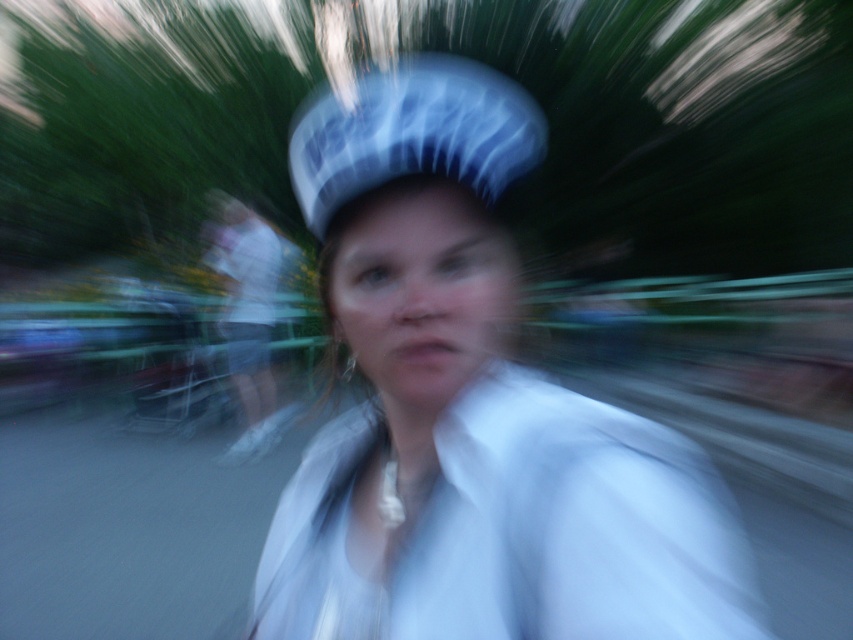
You are a photographer who just took a motion blurred photo. In the image, you see a white silky dress shirt at center and a white striped bicycle helmet at center. Which object appears bigger in the photo?

The white silky dress shirt at center appears bigger in the photo because it has a larger size compared to the white striped bicycle helmet at center.

Looking at this image, you are a photographer trying to capture a clear image of the white silky dress shirt at center and the white striped bicycle helmet at center in a non blurred manner. What adjustment can you make to reduce motion blur?

To reduce motion blur, you can increase the camera shutter speed. This will allow less time for movement to affect the image, resulting in clearer details of the white silky dress shirt at center and the white striped bicycle helmet at center.